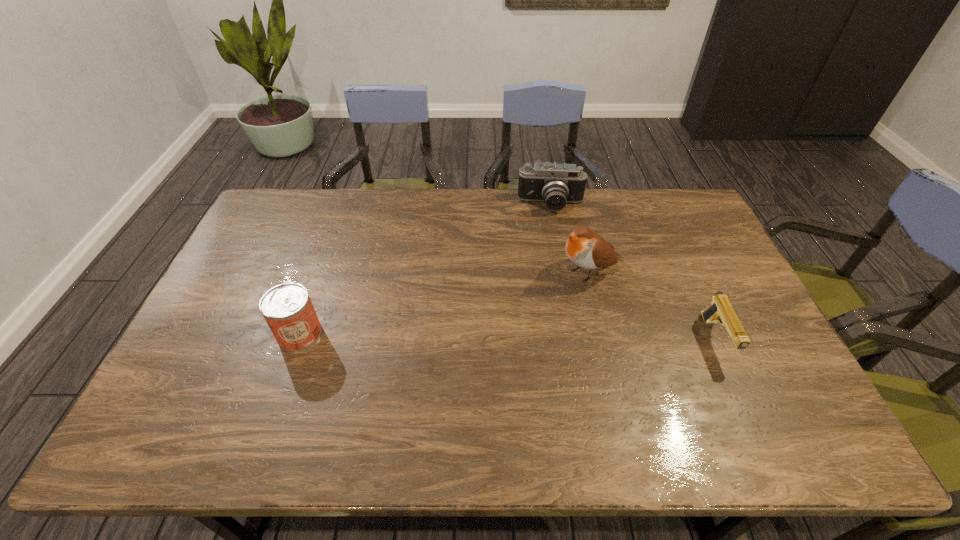
The height and width of the screenshot is (540, 960). In the image, there is a desktop. Find the location of `vacant space at the far right corner`. vacant space at the far right corner is located at coordinates (704, 226).

Identify the location of vacant space that's between the farthest object and the rightmost object. The width and height of the screenshot is (960, 540). (634, 273).

The height and width of the screenshot is (540, 960). Identify the location of free spot between the leftmost object and the bird. (444, 302).

Locate an element on the screen. The width and height of the screenshot is (960, 540). free area in between the pistol and the bird is located at coordinates (652, 305).

At what (x,y) coordinates should I click in order to perform the action: click on free spot between the rightmost object and the bird. Please return your answer as a coordinate pair (x, y). Looking at the image, I should click on (652, 305).

You are a GUI agent. You are given a task and a screenshot of the screen. Output one action in this format:
    pyautogui.click(x=<x>, y=<y>)
    Task: Click on the free spot between the pistol and the leftmost object
    This screenshot has height=540, width=960.
    Given the screenshot: What is the action you would take?
    pyautogui.click(x=508, y=337)

Locate an element on the screen. This screenshot has width=960, height=540. free space between the shortest object and the third nearest object is located at coordinates (652, 305).

Find the location of a particular element. Image resolution: width=960 pixels, height=540 pixels. vacant space that's between the rightmost object and the bird is located at coordinates coord(652,305).

Locate an element on the screen. free area in between the leftmost object and the camera is located at coordinates (425, 270).

This screenshot has height=540, width=960. In order to click on free space between the shortest object and the can in this screenshot , I will do `click(508, 337)`.